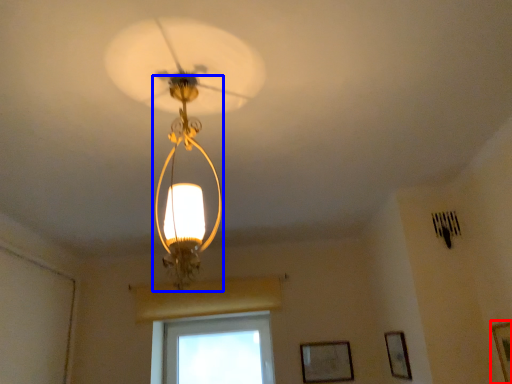
Question: Which point is further to the camera, picture frame (highlighted by a red box) or light fixture (highlighted by a blue box)?

Choices:
 (A) picture frame
 (B) light fixture

Answer: (A)